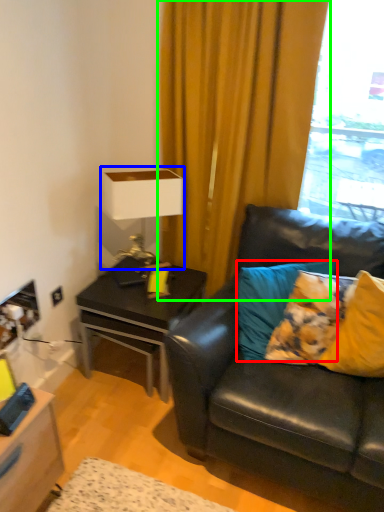
Question: Which object is positioned closest to pillow (highlighted by a red box)? Select from table lamp (highlighted by a blue box) and curtain (highlighted by a green box).

Choices:
 (A) table lamp
 (B) curtain

Answer: (A)